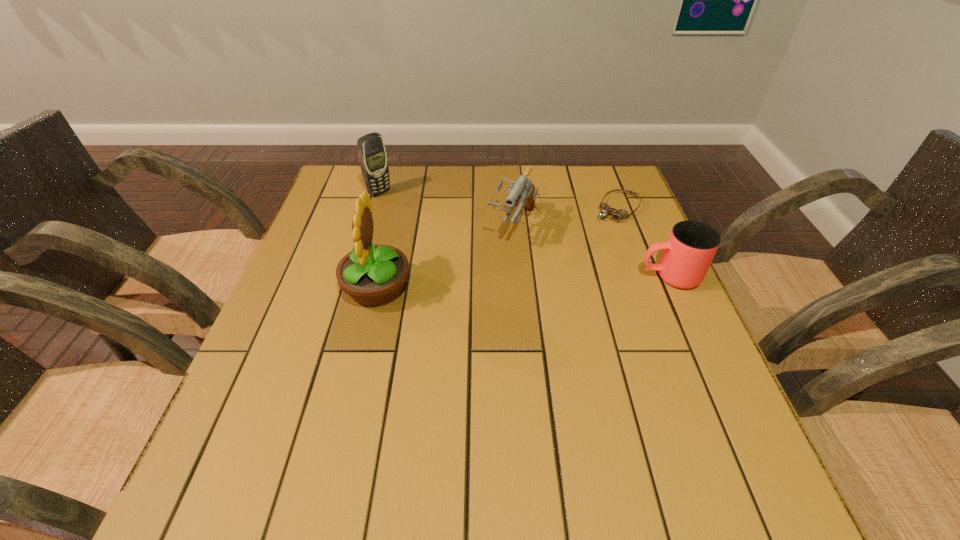
The width and height of the screenshot is (960, 540). Find the location of `the tallest object`. the tallest object is located at coordinates (373, 275).

Identify the location of the second shortest object. (691, 246).

I want to click on goggles, so click(605, 210).

Where is `gun`? The height and width of the screenshot is (540, 960). gun is located at coordinates (523, 188).

The width and height of the screenshot is (960, 540). I want to click on the third object from left to right, so click(523, 188).

Locate an element on the screen. The width and height of the screenshot is (960, 540). cellular telephone is located at coordinates (372, 155).

Where is `blank space located on the face of the tallest object`? This screenshot has height=540, width=960. blank space located on the face of the tallest object is located at coordinates (317, 287).

At what (x,y) coordinates should I click in order to perform the action: click on free point located on the face of the tallest object. Please return your answer as a coordinate pair (x, y). This screenshot has height=540, width=960. Looking at the image, I should click on (321, 287).

At what (x,y) coordinates should I click in order to perform the action: click on free location located 0.120m on the face of the tallest object. Please return your answer as a coordinate pair (x, y). This screenshot has height=540, width=960. Looking at the image, I should click on (290, 287).

Where is `free space located 0.090m on the handle side of the second shortest object`? This screenshot has height=540, width=960. free space located 0.090m on the handle side of the second shortest object is located at coordinates (601, 276).